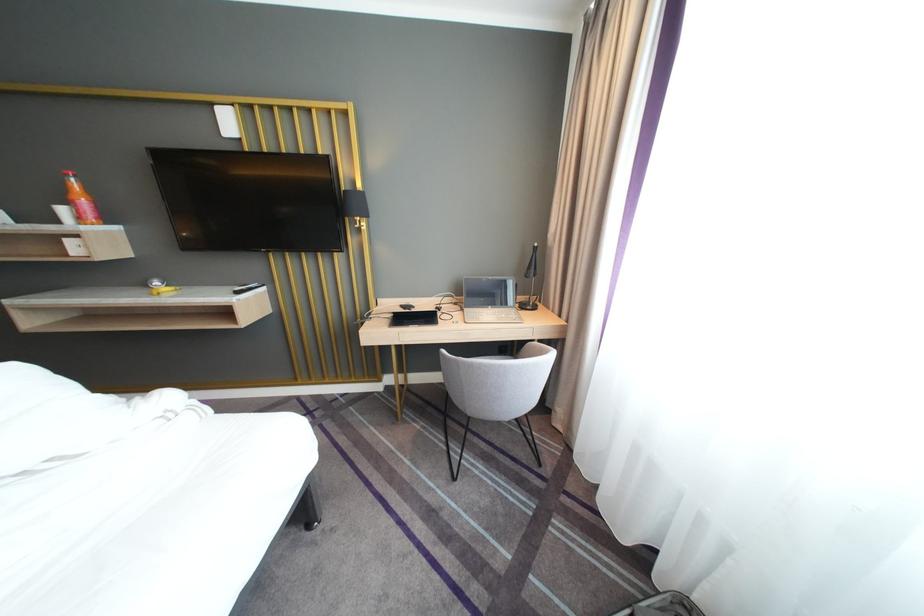
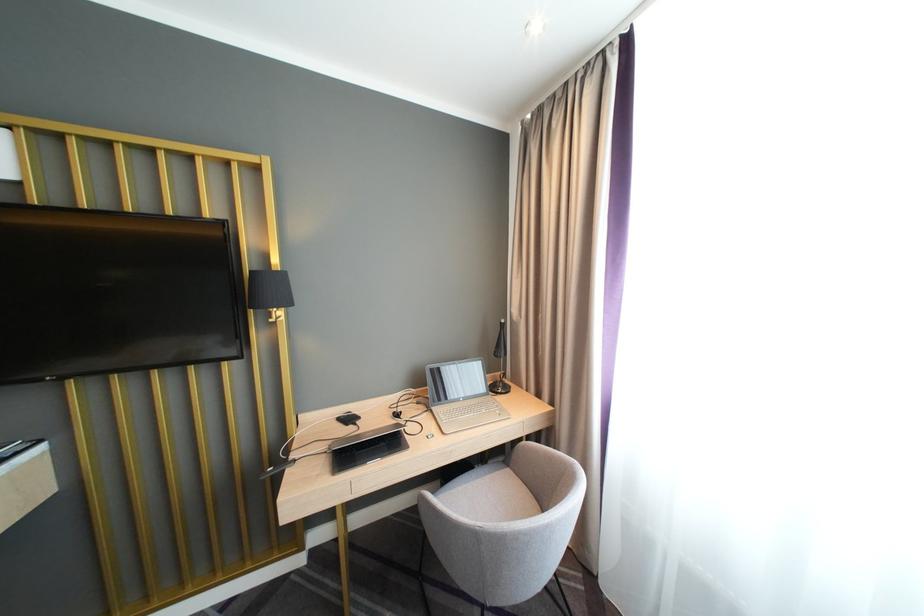
Find the pixel in the second image that matches the point at 399,320 in the first image.

(335, 456)